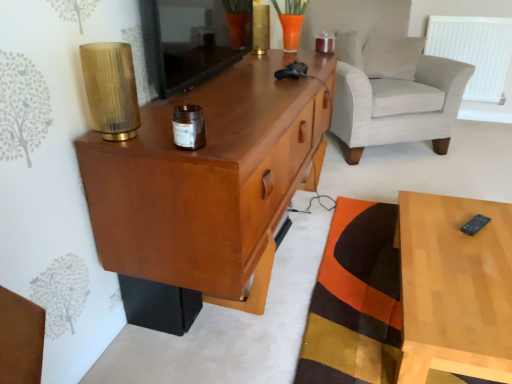
The image size is (512, 384). Find the location of `free point behind brown glass jar at center, which appears as the 1th candle holder when ordered from the bottom`. free point behind brown glass jar at center, which appears as the 1th candle holder when ordered from the bottom is located at coordinates (216, 122).